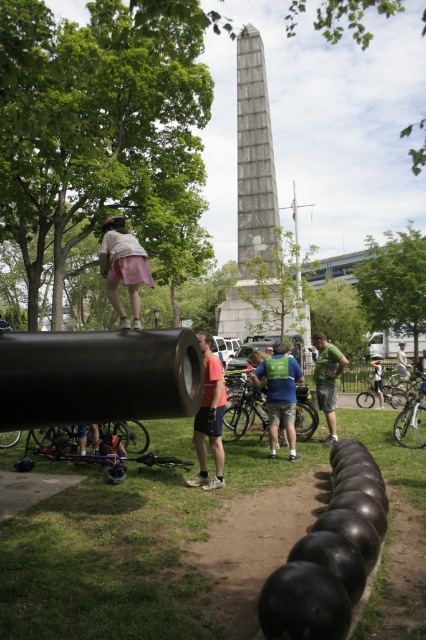
Question: Is pink fabric skirt at upper center in front of green matte shirt at center?

Choices:
 (A) yes
 (B) no

Answer: (A)

Question: Which object appears closest to the camera in this image?

Choices:
 (A) green fabric shirt at center
 (B) black matte cannon at center
 (C) gray stone obelisk at center

Answer: (B)

Question: Which point is closer to the camera taking this photo?

Choices:
 (A) (215, 387)
 (B) (83, 371)
 (C) (239, 228)
 (D) (400, 385)

Answer: (B)

Question: Is gray stone obelisk at center to the right of blue fabric shirt at center from the viewer's perspective?

Choices:
 (A) yes
 (B) no

Answer: (A)

Question: Is blue fabric shirt at center smaller than light blue denim shorts at center?

Choices:
 (A) yes
 (B) no

Answer: (A)

Question: Which point is closer to the camera?

Choices:
 (A) green matte shirt at center
 (B) light blue denim shorts at center
 (C) pink fabric skirt at upper center

Answer: (C)